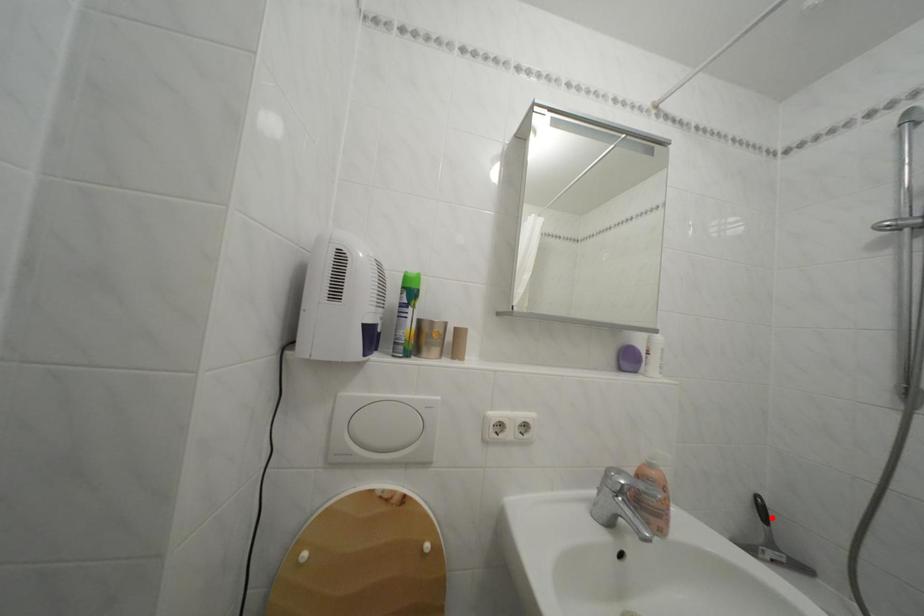
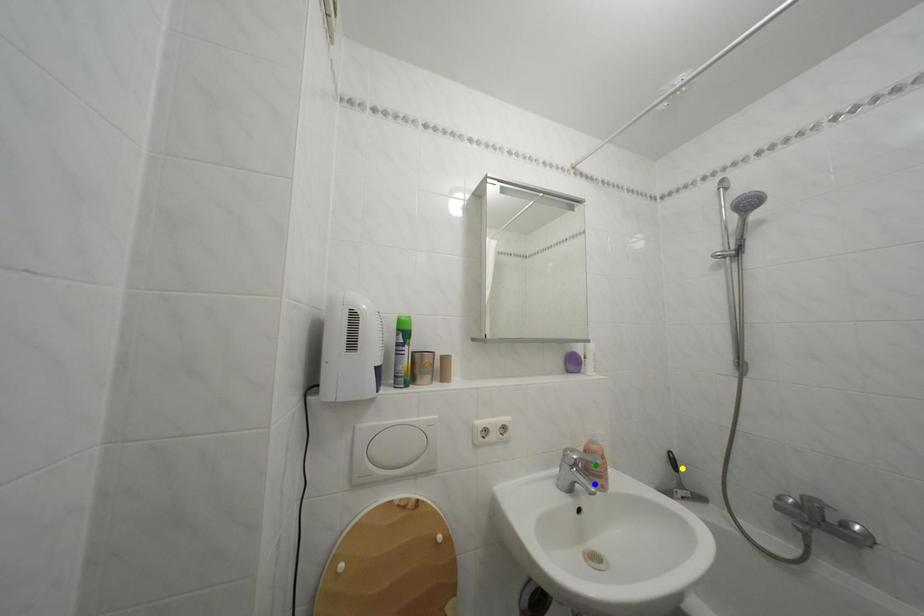
Question: I am providing you with two images of the same scene from different viewpoints. A red point is marked on the first image. You are given multiple points on the second image. Which spot in image 2 lines up with the point in image 1?

Choices:
 (A) green point
 (B) yellow point
 (C) blue point

Answer: (B)